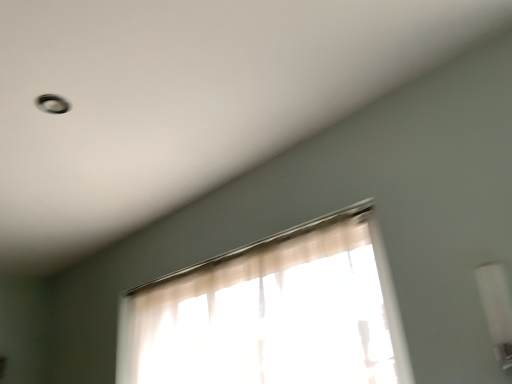
The image size is (512, 384). What are the coordinates of `white glossy lampshade at upper right` in the screenshot? It's located at (497, 308).

Describe the element at coordinates (497, 308) in the screenshot. I see `white glossy lampshade at upper right` at that location.

The width and height of the screenshot is (512, 384). Identify the location of white glossy lampshade at upper right. (497, 308).